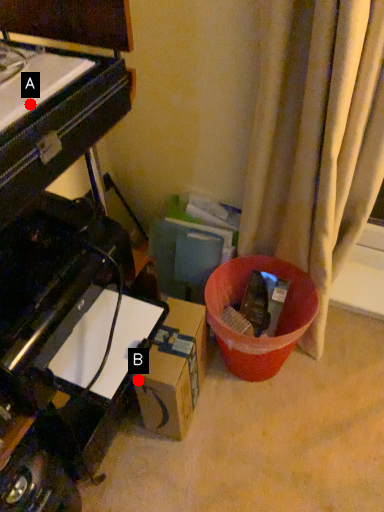
Question: Two points are circled on the image, labeled by A and B beside each circle. Which point is farther to the camera?

Choices:
 (A) A is further
 (B) B is further

Answer: (B)